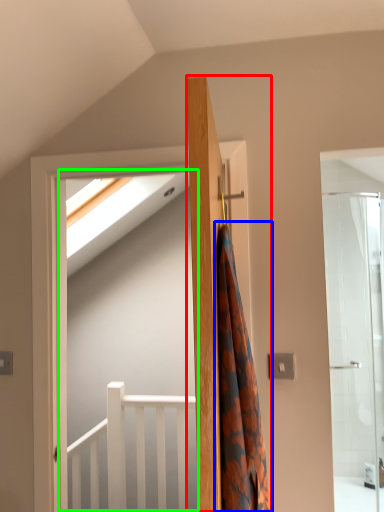
Question: Which object is positioned farthest from door (highlighted by a red box)? Select from shower curtain (highlighted by a blue box) and screen door (highlighted by a green box).

Choices:
 (A) shower curtain
 (B) screen door

Answer: (B)